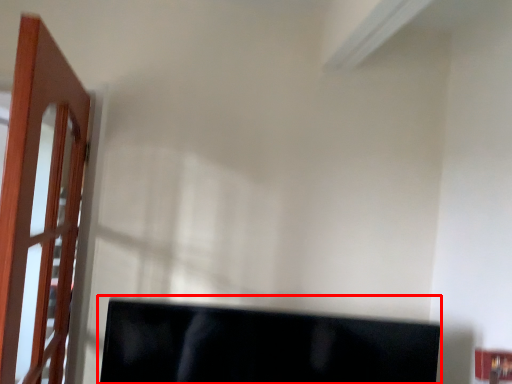
Question: From the image's perspective, considering the relative positions of computer monitor (annotated by the red box) and door in the image provided, where is computer monitor (annotated by the red box) located with respect to the staircase?

Choices:
 (A) below
 (B) above

Answer: (A)